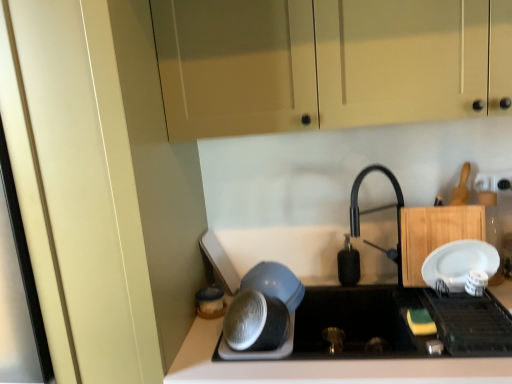
Question: Does black matte soap dispenser at center, marked as the 1th appliance in a back-to-front arrangement, have a lesser width compared to white plastic electric outlet at upper right?

Choices:
 (A) yes
 (B) no

Answer: (B)

Question: Considering the relative sizes of black matte soap dispenser at center, placed as the 2th appliance when sorted from right to left, and white plastic electric outlet at upper right in the image provided, is black matte soap dispenser at center, placed as the 2th appliance when sorted from right to left, taller than white plastic electric outlet at upper right?

Choices:
 (A) yes
 (B) no

Answer: (A)

Question: Is black matte soap dispenser at center, which is the 4th appliance from front to back, far from white plastic electric outlet at upper right?

Choices:
 (A) no
 (B) yes

Answer: (A)

Question: Considering the relative sizes of black matte soap dispenser at center, which is the 4th appliance from front to back, and white plastic electric outlet at upper right in the image provided, is black matte soap dispenser at center, which is the 4th appliance from front to back, wider than white plastic electric outlet at upper right?

Choices:
 (A) no
 (B) yes

Answer: (B)

Question: Is black matte soap dispenser at center, placed as the 2th appliance when sorted from right to left, facing away from white plastic electric outlet at upper right?

Choices:
 (A) yes
 (B) no

Answer: (B)

Question: From the image's perspective, is matte cream cabinet at upper center, the 1th cabinetry when ordered from top to bottom, positioned above or below white plastic electric outlet at upper right?

Choices:
 (A) below
 (B) above

Answer: (B)

Question: Is matte cream cabinet at upper center, the second cabinetry ordered from the bottom, taller or shorter than white plastic electric outlet at upper right?

Choices:
 (A) short
 (B) tall

Answer: (B)

Question: From a real-world perspective, is matte cream cabinet at upper center, the 1th cabinetry when ordered from top to bottom, physically located above or below white plastic electric outlet at upper right?

Choices:
 (A) below
 (B) above

Answer: (B)

Question: Does point (321, 46) appear closer or farther from the camera than point (494, 175)?

Choices:
 (A) farther
 (B) closer

Answer: (B)

Question: Is wooden cutting board at right, placed as the first cabinetry when sorted from bottom to top, situated inside black matte soap dispenser at center, marked as the third appliance in a left-to-right arrangement, or outside?

Choices:
 (A) outside
 (B) inside

Answer: (A)

Question: Is wooden cutting board at right, the 2th cabinetry from the top, wider or thinner than black matte soap dispenser at center, marked as the third appliance in a left-to-right arrangement?

Choices:
 (A) thin
 (B) wide

Answer: (A)

Question: Is wooden cutting board at right, placed as the first cabinetry when sorted from bottom to top, in front of or behind black matte soap dispenser at center, which is the 4th appliance from front to back, in the image?

Choices:
 (A) behind
 (B) front

Answer: (B)

Question: From the image's perspective, is wooden cutting board at right, placed as the first cabinetry when sorted from bottom to top, positioned above or below black matte soap dispenser at center, marked as the 1th appliance in a back-to-front arrangement?

Choices:
 (A) above
 (B) below

Answer: (A)

Question: Is point (199, 289) closer or farther from the camera than point (419, 274)?

Choices:
 (A) closer
 (B) farther

Answer: (B)

Question: In terms of width, does matte plastic container at lower center, marked as the first appliance in a left-to-right arrangement, look wider or thinner when compared to wooden cutting board at right, the 2th cabinetry from the top?

Choices:
 (A) thin
 (B) wide

Answer: (B)